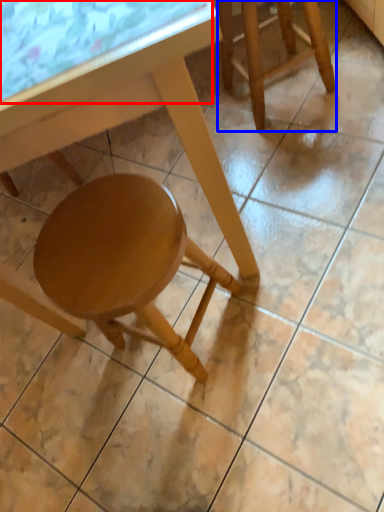
Question: Which object appears farthest to the camera in this image, glass table (highlighted by a red box) or stool (highlighted by a blue box)?

Choices:
 (A) glass table
 (B) stool

Answer: (B)